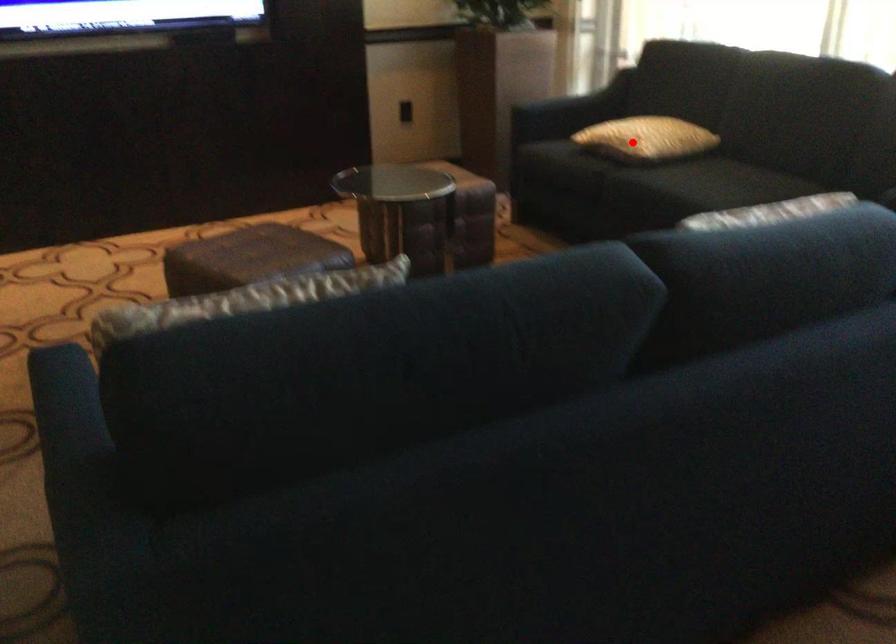
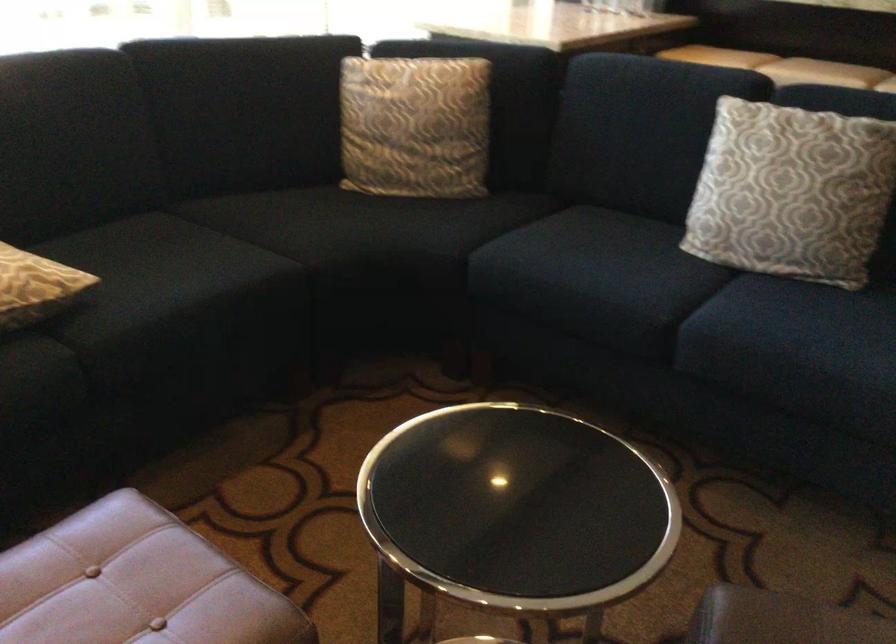
The point at the highlighted location is marked in the first image. Where is the corresponding point in the second image?

(35, 287)